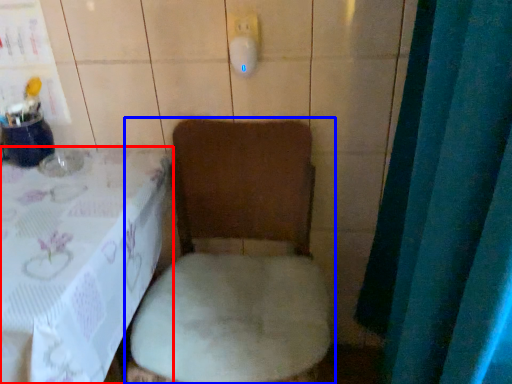
Question: Which object is closer to the camera taking this photo, furniture (highlighted by a red box) or toilet (highlighted by a blue box)?

Choices:
 (A) furniture
 (B) toilet

Answer: (A)